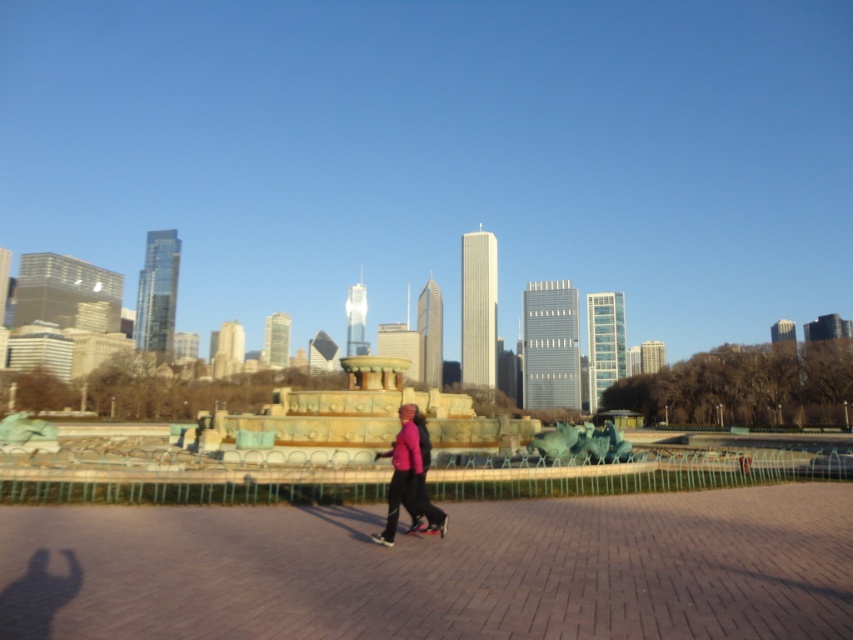
Between brick pavement at center and pink matte jacket at center, which one has more height?

pink matte jacket at center

Who is shorter, brick pavement at center or pink matte jacket at center?

With less height is brick pavement at center.

Who is more forward, (x=567, y=568) or (x=405, y=428)?

Point (x=567, y=568)

Where is `brick pavement at center`? The height and width of the screenshot is (640, 853). brick pavement at center is located at coordinates (439, 570).